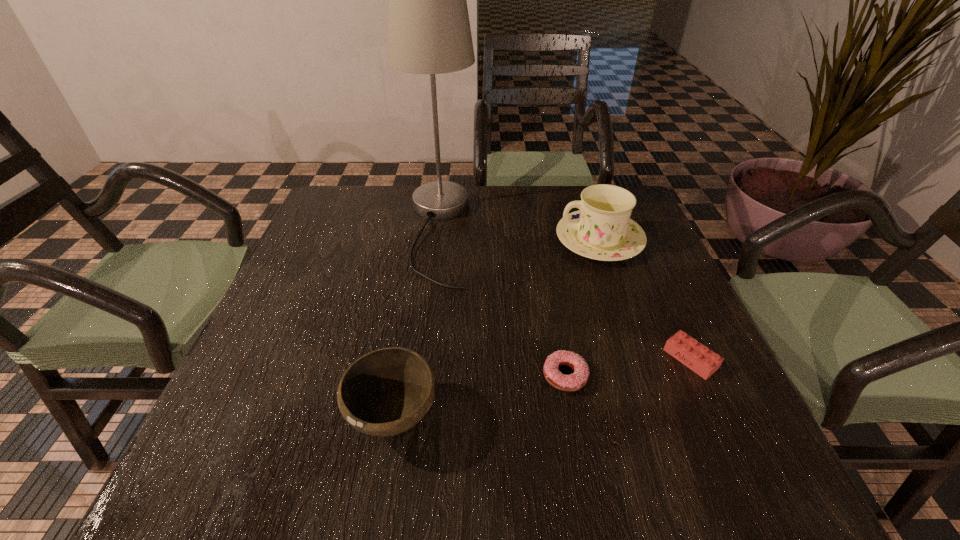
Image resolution: width=960 pixels, height=540 pixels. In order to click on the tallest object in this screenshot , I will do `click(429, 32)`.

Locate an element on the screen. the second tallest object is located at coordinates (602, 229).

This screenshot has height=540, width=960. I want to click on bowl, so click(386, 392).

Find the location of a particular element. This screenshot has height=540, width=960. Lego is located at coordinates tap(697, 357).

Find the location of a particular element. doughnut is located at coordinates (570, 383).

You are a GUI agent. You are given a task and a screenshot of the screen. Output one action in this format:
    pyautogui.click(x=<x>, y=<y>)
    Task: Click on the free space located on the front of the tallest object
    The width and height of the screenshot is (960, 540).
    Given the screenshot: What is the action you would take?
    pyautogui.click(x=422, y=353)

Find the location of a particular element. Image resolution: width=960 pixels, height=540 pixels. free location located on the handle side of the chinaware is located at coordinates (414, 240).

Locate an element on the screen. This screenshot has height=540, width=960. vacant region located on the handle side of the chinaware is located at coordinates (471, 240).

I want to click on vacant space located 0.100m on the handle side of the chinaware, so click(517, 240).

This screenshot has height=540, width=960. Identify the location of vacant region located 0.110m on the left of the third tallest object. (284, 416).